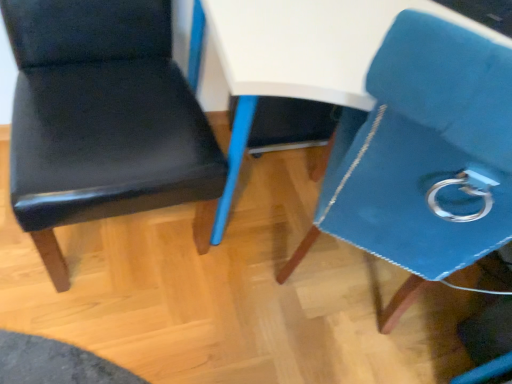
Identify the location of blue leather chair at upper right, the 2th chair from the left. The height and width of the screenshot is (384, 512). (422, 156).

The height and width of the screenshot is (384, 512). Describe the element at coordinates (422, 156) in the screenshot. I see `blue leather chair at upper right, the 2th chair from the left` at that location.

Where is `matte black chair at left, arranged as the second chair when viewed from the right`? matte black chair at left, arranged as the second chair when viewed from the right is located at coordinates (101, 118).

What is the approximate height of matte black chair at left, placed as the 1th chair when sorted from left to right?

matte black chair at left, placed as the 1th chair when sorted from left to right, is 36.50 inches tall.

This screenshot has width=512, height=384. What do you see at coordinates (101, 118) in the screenshot?
I see `matte black chair at left, placed as the 1th chair when sorted from left to right` at bounding box center [101, 118].

This screenshot has width=512, height=384. I want to click on blue leather chair at upper right, the first chair viewed from the right, so click(x=422, y=156).

Does matte black chair at left, arranged as the second chair when viewed from the right, appear on the left side of blue leather chair at upper right, the first chair viewed from the right?

Yes.

Which is behind, matte black chair at left, placed as the 1th chair when sorted from left to right, or blue leather chair at upper right, the 2th chair from the left?

matte black chair at left, placed as the 1th chair when sorted from left to right, is further from the camera.

Is point (155, 28) closer or farther from the camera than point (438, 103)?

Clearly, point (155, 28) is more distant from the camera than point (438, 103).

From the image's perspective, is matte black chair at left, placed as the 1th chair when sorted from left to right, located above or below blue leather chair at upper right, the 2th chair from the left?

From the image's perspective, matte black chair at left, placed as the 1th chair when sorted from left to right, appears above blue leather chair at upper right, the 2th chair from the left.

From a real-world perspective, is matte black chair at left, placed as the 1th chair when sorted from left to right, physically located above or below blue leather chair at upper right, the first chair viewed from the right?

Clearly, from a real-world perspective, matte black chair at left, placed as the 1th chair when sorted from left to right, is below blue leather chair at upper right, the first chair viewed from the right.

In terms of width, does matte black chair at left, arranged as the second chair when viewed from the right, look wider or thinner when compared to blue leather chair at upper right, the first chair viewed from the right?

Considering their sizes, matte black chair at left, arranged as the second chair when viewed from the right, looks slimmer than blue leather chair at upper right, the first chair viewed from the right.

Which of these two, matte black chair at left, arranged as the second chair when viewed from the right, or blue leather chair at upper right, the 2th chair from the left, stands taller?

blue leather chair at upper right, the 2th chair from the left, is taller.

Looking at the image, does matte black chair at left, placed as the 1th chair when sorted from left to right, seem bigger or smaller compared to blue leather chair at upper right, the 2th chair from the left?

Considering their sizes, matte black chair at left, placed as the 1th chair when sorted from left to right, takes up less space than blue leather chair at upper right, the 2th chair from the left.

Is blue leather chair at upper right, the 2th chair from the left, inside matte black chair at left, arranged as the second chair when viewed from the right?

No, blue leather chair at upper right, the 2th chair from the left, is not surrounded by matte black chair at left, arranged as the second chair when viewed from the right.

Is matte black chair at left, arranged as the second chair when viewed from the right, far from blue leather chair at upper right, the 2th chair from the left?

They are positioned close to each other.

Does matte black chair at left, arranged as the second chair when viewed from the right, turn towards blue leather chair at upper right, the first chair viewed from the right?

No, matte black chair at left, arranged as the second chair when viewed from the right, is not facing towards blue leather chair at upper right, the first chair viewed from the right.

How different are the orientations of matte black chair at left, placed as the 1th chair when sorted from left to right, and blue leather chair at upper right, the 2th chair from the left, in degrees?

There is a 132-degree angle between the facing directions of matte black chair at left, placed as the 1th chair when sorted from left to right, and blue leather chair at upper right, the 2th chair from the left.

Identify the location of chair lying above the blue leather chair at upper right, the first chair viewed from the right (from the image's perspective). This screenshot has height=384, width=512. (101, 118).

Can you confirm if blue leather chair at upper right, the first chair viewed from the right, is positioned to the right of matte black chair at left, placed as the 1th chair when sorted from left to right?

Yes, blue leather chair at upper right, the first chair viewed from the right, is to the right of matte black chair at left, placed as the 1th chair when sorted from left to right.

Does blue leather chair at upper right, the 2th chair from the left, lie behind matte black chair at left, arranged as the second chair when viewed from the right?

That is False.

Is point (431, 180) more distant than point (155, 143)?

That is False.

From the image's perspective, is blue leather chair at upper right, the first chair viewed from the right, above matte black chair at left, arranged as the second chair when viewed from the right?

No, from the image's perspective, blue leather chair at upper right, the first chair viewed from the right, is not above matte black chair at left, arranged as the second chair when viewed from the right.

From a real-world perspective, is blue leather chair at upper right, the 2th chair from the left, positioned above or below matte black chair at left, placed as the 1th chair when sorted from left to right?

Clearly, from a real-world perspective, blue leather chair at upper right, the 2th chair from the left, is above matte black chair at left, placed as the 1th chair when sorted from left to right.

Considering the sizes of blue leather chair at upper right, the 2th chair from the left, and matte black chair at left, placed as the 1th chair when sorted from left to right, in the image, is blue leather chair at upper right, the 2th chair from the left, wider or thinner than matte black chair at left, placed as the 1th chair when sorted from left to right,?

Considering their sizes, blue leather chair at upper right, the 2th chair from the left, looks broader than matte black chair at left, placed as the 1th chair when sorted from left to right.

Between blue leather chair at upper right, the first chair viewed from the right, and matte black chair at left, arranged as the second chair when viewed from the right, which one has more height?

blue leather chair at upper right, the first chair viewed from the right, is taller.

Is blue leather chair at upper right, the 2th chair from the left, smaller than matte black chair at left, placed as the 1th chair when sorted from left to right?

No.

Is blue leather chair at upper right, the 2th chair from the left, surrounding matte black chair at left, arranged as the second chair when viewed from the right?

No, matte black chair at left, arranged as the second chair when viewed from the right, is located outside of blue leather chair at upper right, the 2th chair from the left.

Based on the photo, are blue leather chair at upper right, the 2th chair from the left, and matte black chair at left, placed as the 1th chair when sorted from left to right, beside each other?

Result: No, blue leather chair at upper right, the 2th chair from the left, is not in contact with matte black chair at left, placed as the 1th chair when sorted from left to right.

Is blue leather chair at upper right, the 2th chair from the left, aimed at matte black chair at left, placed as the 1th chair when sorted from left to right?

No, blue leather chair at upper right, the 2th chair from the left, is not facing towards matte black chair at left, placed as the 1th chair when sorted from left to right.

Measure the distance from blue leather chair at upper right, the first chair viewed from the right, to matte black chair at left, placed as the 1th chair when sorted from left to right.

They are 53.32 centimeters apart.

Identify the location of chair on the right side of matte black chair at left, placed as the 1th chair when sorted from left to right. (422, 156).

At what (x,y) coordinates should I click in order to perform the action: click on chair on the right of matte black chair at left, arranged as the second chair when viewed from the right. Please return your answer as a coordinate pair (x, y). Looking at the image, I should click on (422, 156).

Find the location of a particular element. The width and height of the screenshot is (512, 384). chair below the blue leather chair at upper right, the 2th chair from the left (from a real-world perspective) is located at coordinates (101, 118).